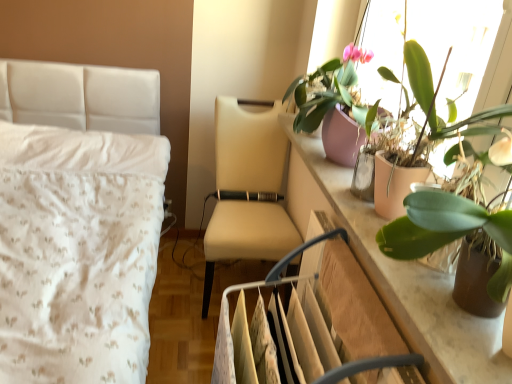
Question: Is green matte plant at upper right, arranged as the first houseplant when viewed from the front, at the back of beige fabric chair at center?

Choices:
 (A) no
 (B) yes

Answer: (A)

Question: From a real-world perspective, is beige fabric chair at center located beneath green matte plant at upper right, arranged as the first houseplant when viewed from the front?

Choices:
 (A) yes
 (B) no

Answer: (A)

Question: Is beige fabric chair at center at the left side of green matte plant at upper right, arranged as the first houseplant when viewed from the front?

Choices:
 (A) no
 (B) yes

Answer: (B)

Question: Does beige fabric chair at center lie behind green matte plant at upper right, arranged as the first houseplant when viewed from the front?

Choices:
 (A) no
 (B) yes

Answer: (B)

Question: Is green matte plant at upper right, marked as the 3th houseplant in a back-to-front arrangement, inside beige fabric chair at center?

Choices:
 (A) no
 (B) yes

Answer: (A)

Question: Is green matte plant at upper right, marked as the 3th houseplant in a back-to-front arrangement, inside the boundaries of green matte leafy plant at upper right, the second houseplant viewed from the back, or outside?

Choices:
 (A) inside
 (B) outside

Answer: (B)

Question: Is point (426, 241) closer or farther from the camera than point (479, 264)?

Choices:
 (A) closer
 (B) farther

Answer: (B)

Question: From their relative heights in the image, would you say green matte plant at upper right, arranged as the first houseplant when viewed from the front, is taller or shorter than green matte leafy plant at upper right, acting as the second houseplant starting from the front?

Choices:
 (A) short
 (B) tall

Answer: (B)

Question: From a real-world perspective, is green matte plant at upper right, marked as the 3th houseplant in a back-to-front arrangement, physically located above or below green matte leafy plant at upper right, the second houseplant viewed from the back?

Choices:
 (A) below
 (B) above

Answer: (B)

Question: From the image's perspective, is green matte leafy plant at upper right, acting as the second houseplant starting from the front, positioned above or below green matte plant at upper right, arranged as the first houseplant when viewed from the front?

Choices:
 (A) below
 (B) above

Answer: (A)

Question: Is green matte leafy plant at upper right, acting as the second houseplant starting from the front, situated inside green matte plant at upper right, marked as the 3th houseplant in a back-to-front arrangement, or outside?

Choices:
 (A) inside
 (B) outside

Answer: (A)

Question: In the image, is green matte leafy plant at upper right, the second houseplant viewed from the back, positioned in front of or behind green matte plant at upper right, arranged as the first houseplant when viewed from the front?

Choices:
 (A) front
 (B) behind

Answer: (B)

Question: Is green matte leafy plant at upper right, the second houseplant viewed from the back, taller or shorter than green matte plant at upper right, arranged as the first houseplant when viewed from the front?

Choices:
 (A) short
 (B) tall

Answer: (A)

Question: In terms of height, does beige fabric chair at center look taller or shorter compared to green matte leafy plant at upper right, the second houseplant viewed from the back?

Choices:
 (A) tall
 (B) short

Answer: (A)

Question: From a real-world perspective, relative to green matte leafy plant at upper right, the second houseplant viewed from the back, is beige fabric chair at center vertically above or below?

Choices:
 (A) above
 (B) below

Answer: (B)